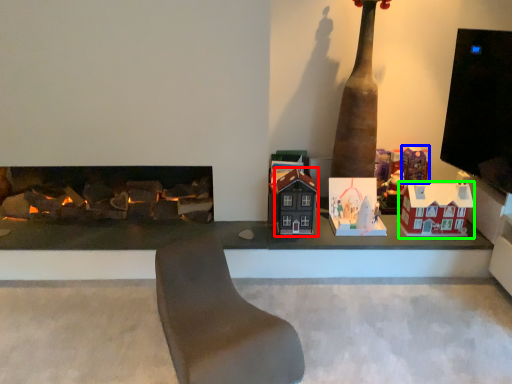
Question: Which object is positioned farthest from toy (highlighted by a red box)? Select from toy (highlighted by a blue box) and toy (highlighted by a green box).

Choices:
 (A) toy
 (B) toy

Answer: (A)